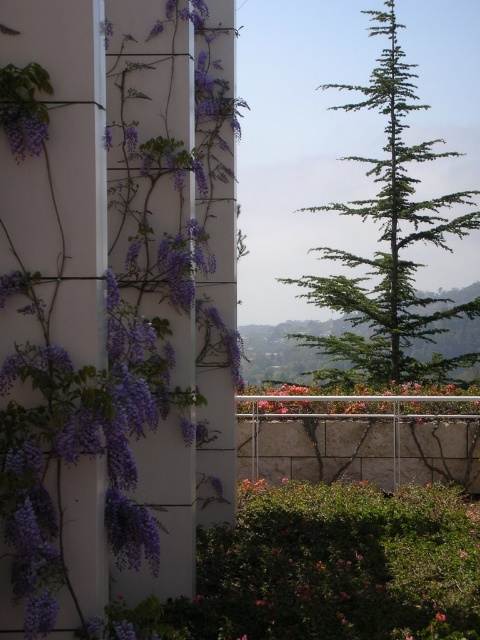
What do you see at coordinates (113, 300) in the screenshot? Image resolution: width=480 pixels, height=640 pixels. I see `purple matte flowers at left` at bounding box center [113, 300].

Can you confirm if purple matte flowers at left is bigger than pink matte flowers at center?

Indeed, purple matte flowers at left has a larger size compared to pink matte flowers at center.

The image size is (480, 640). Describe the element at coordinates (113, 300) in the screenshot. I see `purple matte flowers at left` at that location.

I want to click on purple matte flowers at left, so click(113, 300).

Does purple matte flowers at left have a greater height compared to purple matte flower at upper left?

Correct, purple matte flowers at left is much taller as purple matte flower at upper left.

Is purple matte flowers at left positioned behind purple matte flower at upper left?

Yes, purple matte flowers at left is behind purple matte flower at upper left.

Is point (91, 362) behind point (437, 616)?

No, it is not.

This screenshot has width=480, height=640. Identify the location of purple matte flowers at left. (113, 300).

Which is above, green needle-like tree at right or pink matte flowers at center?

green needle-like tree at right is above.

Which is behind, point (336, 348) or point (285, 396)?

The point (336, 348) is behind.

This screenshot has width=480, height=640. In order to click on green needle-like tree at right in this screenshot , I will do `click(388, 241)`.